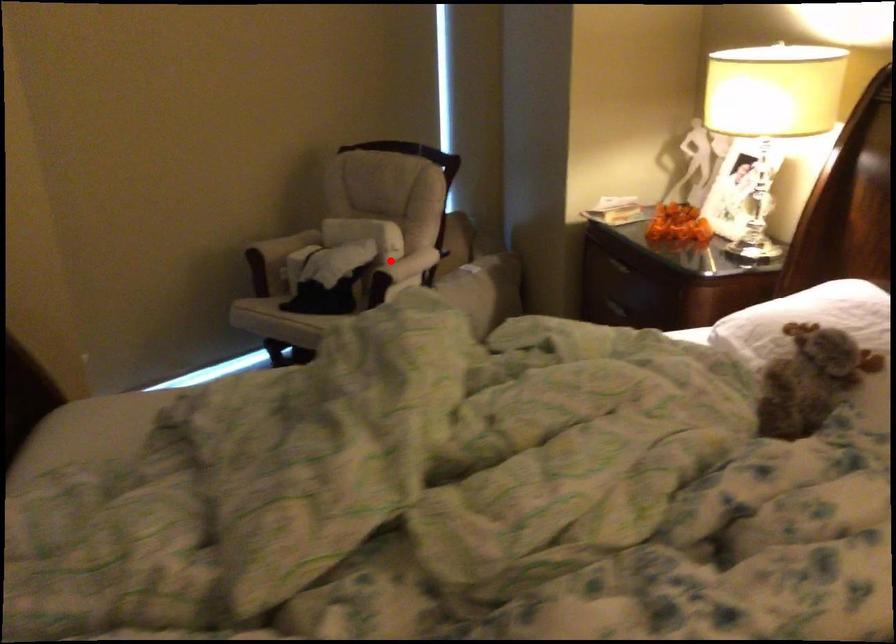
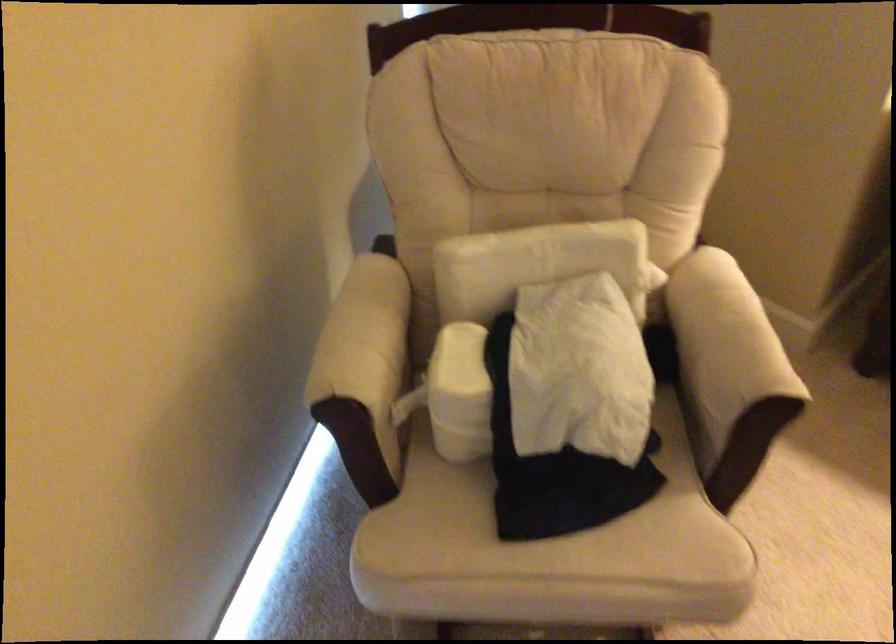
Where in the second image is the point corresponding to the highlighted location from the first image?

(724, 348)